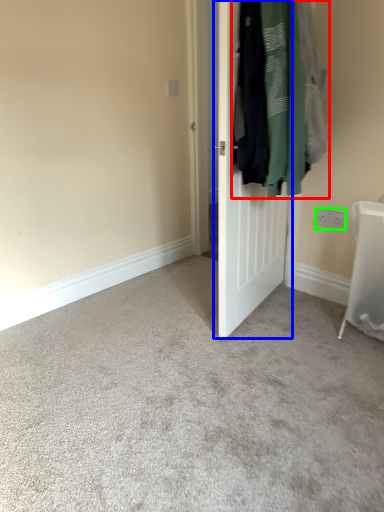
Question: Considering the real-world distances, which object is closest to laundry (highlighted by a red box)? door (highlighted by a blue box) or electric outlet (highlighted by a green box).

Choices:
 (A) door
 (B) electric outlet

Answer: (A)